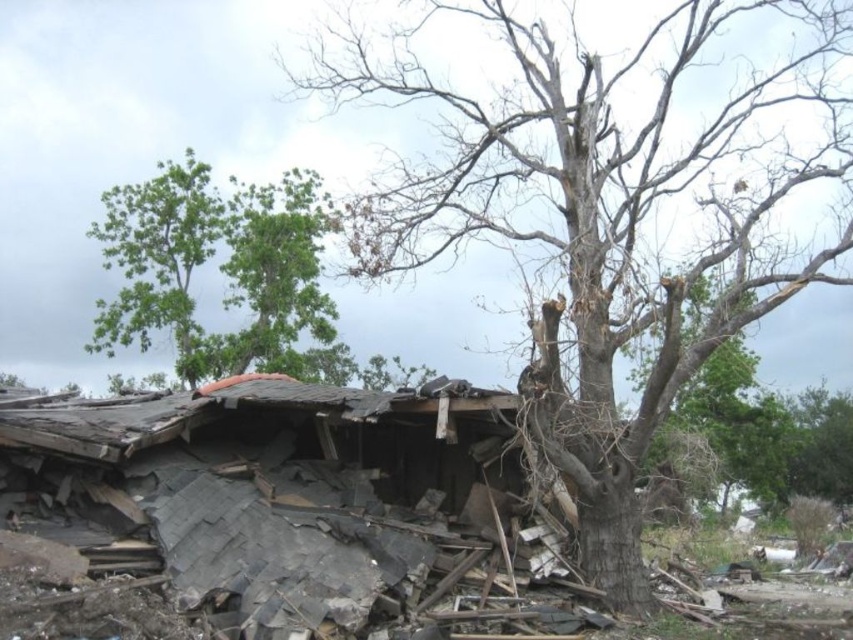
Question: Does bare wood tree at center have a greater width compared to green leafy tree at upper left?

Choices:
 (A) no
 (B) yes

Answer: (B)

Question: Which point appears closest to the camera in this image?

Choices:
 (A) (616, 186)
 (B) (167, 234)

Answer: (A)

Question: Considering the relative positions of bare wood tree at center and green leafy tree at upper left in the image provided, where is bare wood tree at center located with respect to green leafy tree at upper left?

Choices:
 (A) right
 (B) left

Answer: (A)

Question: Among these points, which one is nearest to the camera?

Choices:
 (A) (352, 64)
 (B) (186, 228)

Answer: (A)

Question: Is bare wood tree at center above green leafy tree at upper left?

Choices:
 (A) yes
 (B) no

Answer: (B)